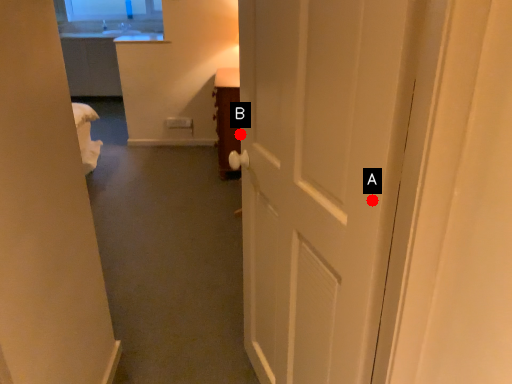
Question: Two points are circled on the image, labeled by A and B beside each circle. Which point is closer to the camera?

Choices:
 (A) A is closer
 (B) B is closer

Answer: (A)